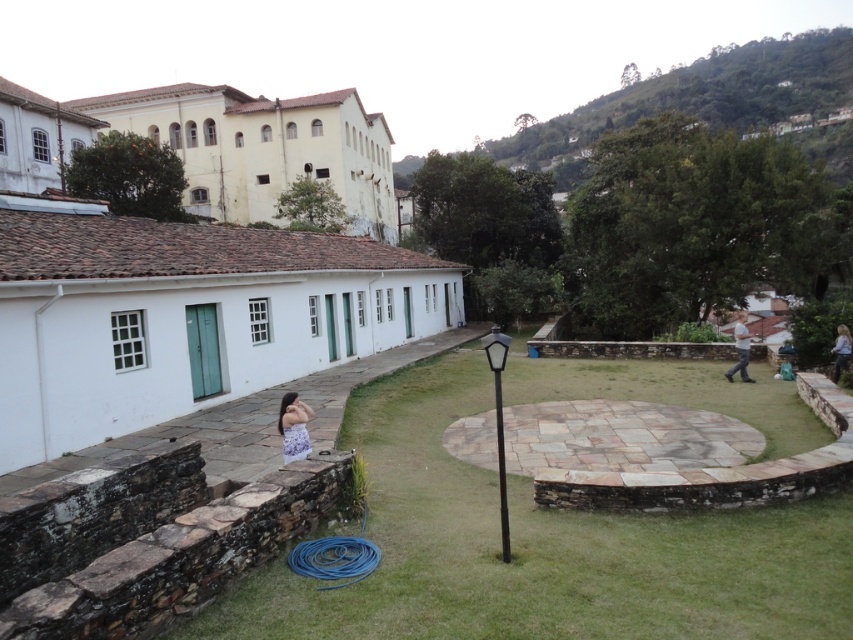
Question: Which object is the farthest from the green grass at lower left?

Choices:
 (A) white fabric shirt at right
 (B) light blue denim dress at lower right
 (C) floral dress at lower center

Answer: (A)

Question: Does green grass at lower left appear under light blue denim dress at lower right?

Choices:
 (A) yes
 (B) no

Answer: (A)

Question: Does green grass at lower left appear over light blue denim dress at lower right?

Choices:
 (A) yes
 (B) no

Answer: (B)

Question: Is green grass at lower left wider than white fabric shirt at right?

Choices:
 (A) yes
 (B) no

Answer: (B)

Question: Estimate the real-world distances between objects in this image. Which object is closer to the white fabric shirt at right?

Choices:
 (A) light blue denim dress at lower right
 (B) green grass at lower left
 (C) floral dress at lower center

Answer: (A)

Question: Among these points, which one is nearest to the camera?

Choices:
 (A) (570, 566)
 (B) (294, 436)

Answer: (A)